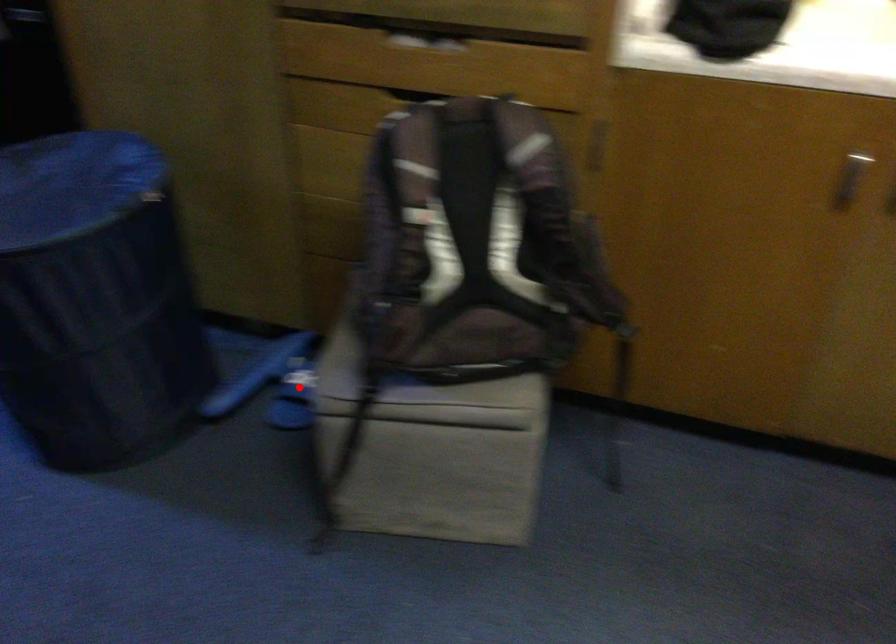
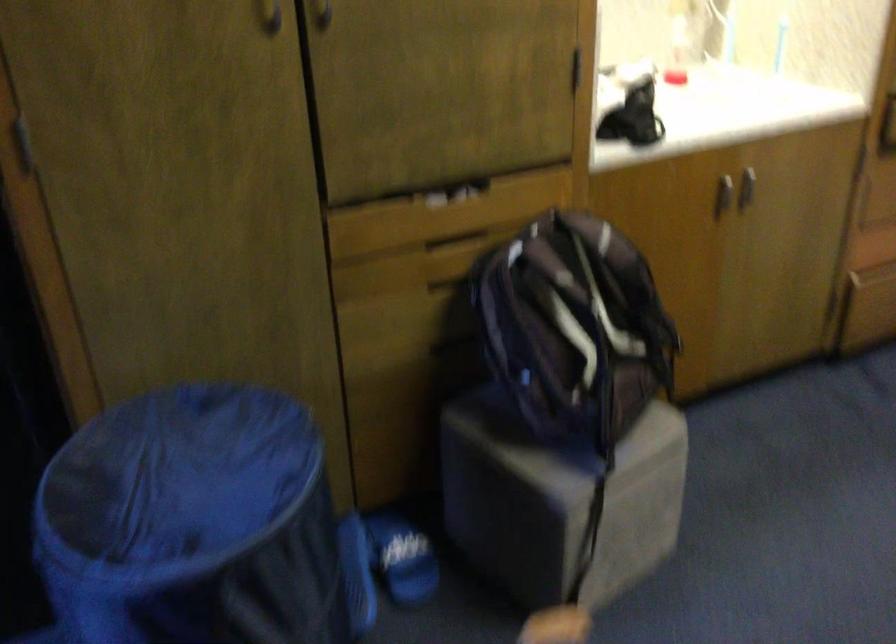
Find the pixel in the second image that matches the highlighted location in the first image.

(401, 558)